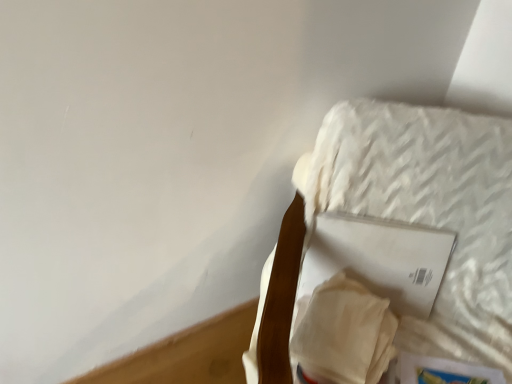
Question: Is hardcover book at lower right, which is counted as the second paperback book, starting from the top, to the right of white matte paper at upper right, the 2th paperback book when ordered from bottom to top, from the viewer's perspective?

Choices:
 (A) yes
 (B) no

Answer: (A)

Question: From a real-world perspective, is hardcover book at lower right, positioned as the first paperback book in bottom-to-top order, located beneath white matte paper at upper right, the 2th paperback book when ordered from bottom to top?

Choices:
 (A) yes
 (B) no

Answer: (A)

Question: Would you say hardcover book at lower right, which is counted as the second paperback book, starting from the top, is a long distance from white matte paper at upper right, which is the first paperback book from top to bottom?

Choices:
 (A) yes
 (B) no

Answer: (B)

Question: Is hardcover book at lower right, positioned as the first paperback book in bottom-to-top order, facing towards white matte paper at upper right, which is the first paperback book from top to bottom?

Choices:
 (A) yes
 (B) no

Answer: (B)

Question: Is hardcover book at lower right, which is counted as the second paperback book, starting from the top, closer to the viewer compared to white matte paper at upper right, which is the first paperback book from top to bottom?

Choices:
 (A) yes
 (B) no

Answer: (A)

Question: From a real-world perspective, relative to white textured mattress at upper right, is white matte paper at upper right, the 2th paperback book when ordered from bottom to top, vertically above or below?

Choices:
 (A) above
 (B) below

Answer: (A)

Question: Considering the positions of point (415, 269) and point (455, 137), is point (415, 269) closer or farther from the camera than point (455, 137)?

Choices:
 (A) farther
 (B) closer

Answer: (A)

Question: Looking at their shapes, would you say white matte paper at upper right, which is the first paperback book from top to bottom, is wider or thinner than white textured mattress at upper right?

Choices:
 (A) thin
 (B) wide

Answer: (A)

Question: Is white matte paper at upper right, which is the first paperback book from top to bottom, bigger or smaller than white textured mattress at upper right?

Choices:
 (A) small
 (B) big

Answer: (A)

Question: From the image's perspective, relative to hardcover book at lower right, positioned as the first paperback book in bottom-to-top order, is white textured mattress at upper right above or below?

Choices:
 (A) below
 (B) above

Answer: (B)

Question: Is white textured mattress at upper right situated inside hardcover book at lower right, which is counted as the second paperback book, starting from the top, or outside?

Choices:
 (A) inside
 (B) outside

Answer: (B)

Question: Is point pyautogui.click(x=476, y=167) positioned closer to the camera than point pyautogui.click(x=462, y=377)?

Choices:
 (A) farther
 (B) closer

Answer: (A)

Question: From a real-world perspective, relative to hardcover book at lower right, positioned as the first paperback book in bottom-to-top order, is white textured mattress at upper right vertically above or below?

Choices:
 (A) below
 (B) above

Answer: (B)

Question: In terms of width, does white textured mattress at upper right look wider or thinner when compared to white matte paper at upper right, which is the first paperback book from top to bottom?

Choices:
 (A) thin
 (B) wide

Answer: (B)

Question: From the image's perspective, is white textured mattress at upper right above or below white matte paper at upper right, the 2th paperback book when ordered from bottom to top?

Choices:
 (A) above
 (B) below

Answer: (B)